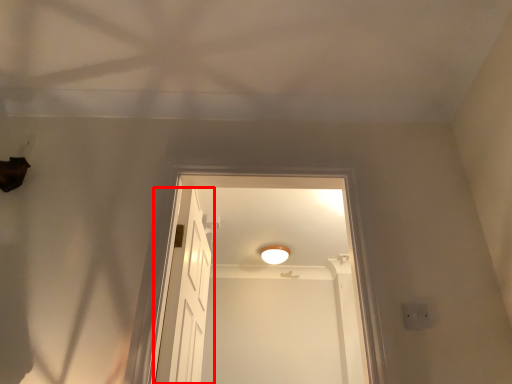
Question: From the image's perspective, where is door (annotated by the red box) located in relation to light fixture in the image?

Choices:
 (A) below
 (B) above

Answer: (A)